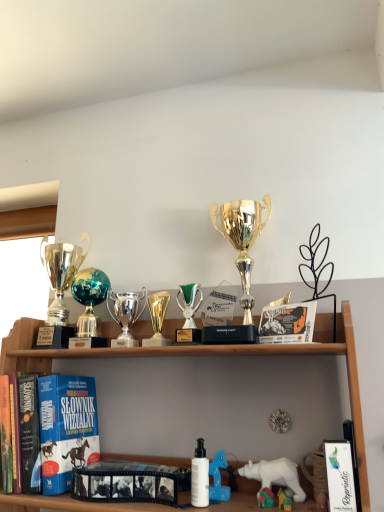
This screenshot has height=512, width=384. I want to click on shiny metallic globe at center, which is the first toy in left-to-right order, so click(x=89, y=298).

The width and height of the screenshot is (384, 512). What are the coordinates of `blue matte book at left, which is the third book from front to back` in the screenshot? It's located at (66, 428).

Identify the location of white matte bottle at center. The height and width of the screenshot is (512, 384). (200, 476).

Measure the distance between point (161, 500) and camera.

They are 38.98 inches apart.

What is the approximate width of shiny silver trophy at left, which is counted as the second trophy, starting from the right?

shiny silver trophy at left, which is counted as the second trophy, starting from the right, is 5.68 inches wide.

Describe the element at coordinates (189, 302) in the screenshot. I see `green metallic trophy at center, positioned as the 4th toy in left-to-right order` at that location.

You are a GUI agent. You are given a task and a screenshot of the screen. Output one action in this format:
    pyautogui.click(x=<x>, y=<y>)
    Task: Click on the shiny metallic globe at center, which is the first toy in left-to-right order
    This screenshot has height=512, width=384.
    Given the screenshot: What is the action you would take?
    pyautogui.click(x=89, y=298)

From the image's perspective, who appears lower, shiny silver trophy at center, which is the 2th toy in left-to-right order, or white matte bottle at center?

white matte bottle at center appears lower in the image.

Where is `toy that is the 2nd object located above the white matte bottle at center (from the image's perspective)`? The width and height of the screenshot is (384, 512). toy that is the 2nd object located above the white matte bottle at center (from the image's perspective) is located at coordinates (126, 314).

Based on the photo, based on their sizes in the image, would you say shiny silver trophy at center, which is the 2th toy in left-to-right order, is bigger or smaller than white matte bottle at center?

shiny silver trophy at center, which is the 2th toy in left-to-right order, is bigger than white matte bottle at center.

Consider the image. From the image's perspective, would you say black matte film strip at center, which appears as the second book when viewed from the front, is positioned over shiny silver trophy at left, placed as the 1th trophy when sorted from left to right?

No, from the image's perspective, black matte film strip at center, which appears as the second book when viewed from the front, is not above shiny silver trophy at left, placed as the 1th trophy when sorted from left to right.

Is point (128, 484) positioned after point (82, 237)?

That is False.

Is shiny silver trophy at center, which is the 2th toy in left-to-right order, not inside gold metallic trophy at center, which is the 3th toy from left to right?

Yes, shiny silver trophy at center, which is the 2th toy in left-to-right order, is not within gold metallic trophy at center, which is the 3th toy from left to right.

Which is in front, shiny silver trophy at center, marked as the 4th toy in a right-to-left arrangement, or gold metallic trophy at center, placed as the 3th toy when sorted from right to left?

Positioned in front is gold metallic trophy at center, placed as the 3th toy when sorted from right to left.

Are shiny silver trophy at center, marked as the 4th toy in a right-to-left arrangement, and gold metallic trophy at center, which is the 3th toy from left to right, making contact?

Yes, shiny silver trophy at center, marked as the 4th toy in a right-to-left arrangement, and gold metallic trophy at center, which is the 3th toy from left to right, clearly make contact.

Is gold metallic trophy at center, placed as the 3th toy when sorted from right to left, at the back of shiny silver trophy at center, marked as the 4th toy in a right-to-left arrangement?

No, shiny silver trophy at center, marked as the 4th toy in a right-to-left arrangement,'s orientation is not away from gold metallic trophy at center, placed as the 3th toy when sorted from right to left.

Considering the relative positions of white plastic bear at lower center and white matte bottle at center in the image provided, is white plastic bear at lower center to the right of white matte bottle at center from the viewer's perspective?

Yes, white plastic bear at lower center is to the right of white matte bottle at center.

Which is closer to the camera, (x=290, y=463) or (x=193, y=493)?

Clearly, point (x=290, y=463) is more distant from the camera than point (x=193, y=493).

Find the location of a particular element. This screenshot has width=384, height=512. toiletry in front of the white plastic bear at lower center is located at coordinates (x=200, y=476).

From a real-world perspective, relative to white matte bottle at center, is white plastic bear at lower center vertically above or below?

Clearly, from a real-world perspective, white plastic bear at lower center is below white matte bottle at center.

Can you tell me how much shiny metallic globe at center, which is the first toy in left-to-right order, and green metallic trophy at center, which is the second toy from right to left, differ in facing direction?

4.58 degrees.

This screenshot has width=384, height=512. Identify the location of toy positioned vertically above the green metallic trophy at center, positioned as the 4th toy in left-to-right order (from a real-world perspective). (89, 298).

Is shiny metallic globe at center, the 5th toy in the right-to-left sequence, at the right side of green metallic trophy at center, which is the second toy from right to left?

No.

Between shiny metallic globe at center, which is the first toy in left-to-right order, and green metallic trophy at center, positioned as the 4th toy in left-to-right order, which one has less height?

With less height is green metallic trophy at center, positioned as the 4th toy in left-to-right order.

Which object is further away from the camera, blue matte book at left, which is the third book from front to back, or white plastic bear at lower right, placed as the 1th toy when sorted from right to left?

blue matte book at left, which is the third book from front to back.

Is blue matte book at left, which is the first book in back-to-front order, turned away from white plastic bear at lower right, positioned as the fifth toy in left-to-right order?

No, white plastic bear at lower right, positioned as the fifth toy in left-to-right order, is not at the back of blue matte book at left, which is the first book in back-to-front order.

Is blue matte book at left, which is the third book from front to back, not near white plastic bear at lower right, positioned as the fifth toy in left-to-right order?

blue matte book at left, which is the third book from front to back, is actually quite close to white plastic bear at lower right, positioned as the fifth toy in left-to-right order.

Who is smaller, blue matte book at left, which is the third book from front to back, or white plastic bear at lower right, positioned as the fifth toy in left-to-right order?

With smaller size is white plastic bear at lower right, positioned as the fifth toy in left-to-right order.

Which of these two, gold metallic trophy at center, which is the 3th toy from left to right, or white matte bottle at center, is thinner?

white matte bottle at center.

Considering the positions of points (151, 319) and (200, 487), is point (151, 319) farther from camera compared to point (200, 487)?

Yes, point (151, 319) is behind point (200, 487).

Does gold metallic trophy at center, placed as the 3th toy when sorted from right to left, have a lesser height compared to white matte bottle at center?

No, gold metallic trophy at center, placed as the 3th toy when sorted from right to left, is not shorter than white matte bottle at center.

Where is `toy that is the 2nd object located above the white matte bottle at center (from the image's perspective)`? This screenshot has height=512, width=384. toy that is the 2nd object located above the white matte bottle at center (from the image's perspective) is located at coordinates (126, 314).

From the image's perspective, which book is the 3rd one below the shiny silver trophy at left, which is counted as the second trophy, starting from the right? Please provide its 2D coordinates.

[(129, 482)]

Based on the photo, considering their positions, is white plastic bear at lower center positioned further to shiny silver trophy at center, marked as the 4th toy in a right-to-left arrangement, than shiny metallic globe at center, which is the first toy in left-to-right order?

white plastic bear at lower center.

Which object lies nearer to the anchor point gold shiny trophy at center, which appears as the 1th trophy when viewed from the right, blue matte book at left, which is counted as the 3th book, starting from the right, or white plastic bear at lower right, positioned as the fifth toy in left-to-right order?

white plastic bear at lower right, positioned as the fifth toy in left-to-right order, lies closer to gold shiny trophy at center, which appears as the 1th trophy when viewed from the right, than the other object.

Considering their positions, is shiny metallic globe at center, which is the first toy in left-to-right order, positioned closer to gold shiny trophy at center, which appears as the 1th trophy when viewed from the right, than green metallic trophy at center, which is the second toy from right to left?

green metallic trophy at center, which is the second toy from right to left, lies closer to gold shiny trophy at center, which appears as the 1th trophy when viewed from the right, than the other object.

Which object lies further to the anchor point white matte bottle at center, gold metallic trophy at center, which is the 3th toy from left to right, or blue matte book at left, which is counted as the 3th book, starting from the right?

blue matte book at left, which is counted as the 3th book, starting from the right.

Considering their positions, is shiny silver trophy at left, which is counted as the second trophy, starting from the right, positioned closer to green metallic trophy at center, positioned as the 4th toy in left-to-right order, than white matte bottle at center?

white matte bottle at center.

Estimate the real-world distances between objects in this image. Which object is further from shiny silver trophy at center, marked as the 4th toy in a right-to-left arrangement, blue matte book at left, which is counted as the 3th book, starting from the right, or white matte bottle at center?

The object further to shiny silver trophy at center, marked as the 4th toy in a right-to-left arrangement, is white matte bottle at center.

Estimate the real-world distances between objects in this image. Which object is further from blue matte book at left, which is counted as the 3th book, starting from the right, white plastic bear at lower center or shiny silver trophy at center, which is the 2th toy in left-to-right order?

Based on the image, white plastic bear at lower center appears to be further to blue matte book at left, which is counted as the 3th book, starting from the right.

Which object lies nearer to the anchor point gold metallic trophy at center, placed as the 3th toy when sorted from right to left, shiny silver trophy at left, which is counted as the second trophy, starting from the right, or white plastic bear at lower right, positioned as the fifth toy in left-to-right order?

shiny silver trophy at left, which is counted as the second trophy, starting from the right, lies closer to gold metallic trophy at center, placed as the 3th toy when sorted from right to left, than the other object.

Where is `animal between gold metallic trophy at center, placed as the 3th toy when sorted from right to left, and black matte film strip at center, which appears as the second book when viewed from the front, from top to bottom`? The width and height of the screenshot is (384, 512). animal between gold metallic trophy at center, placed as the 3th toy when sorted from right to left, and black matte film strip at center, which appears as the second book when viewed from the front, from top to bottom is located at coordinates (275, 475).

The image size is (384, 512). Find the location of `toiletry between green metallic trophy at center, positioned as the 4th toy in left-to-right order, and white plastic bear at lower right, positioned as the fifth toy in left-to-right order, from top to bottom`. toiletry between green metallic trophy at center, positioned as the 4th toy in left-to-right order, and white plastic bear at lower right, positioned as the fifth toy in left-to-right order, from top to bottom is located at coordinates (200, 476).

You are a GUI agent. You are given a task and a screenshot of the screen. Output one action in this format:
    pyautogui.click(x=<x>, y=<y>)
    Task: Click on the toy situated between shiny metallic globe at center, which is the first toy in left-to-right order, and gold metallic trophy at center, placed as the 3th toy when sorted from right to left, from left to right
    The width and height of the screenshot is (384, 512).
    Given the screenshot: What is the action you would take?
    (126, 314)

Find the location of a particular element. The image size is (384, 512). toy between shiny silver trophy at center, marked as the 4th toy in a right-to-left arrangement, and green metallic trophy at center, positioned as the 4th toy in left-to-right order is located at coordinates (157, 318).